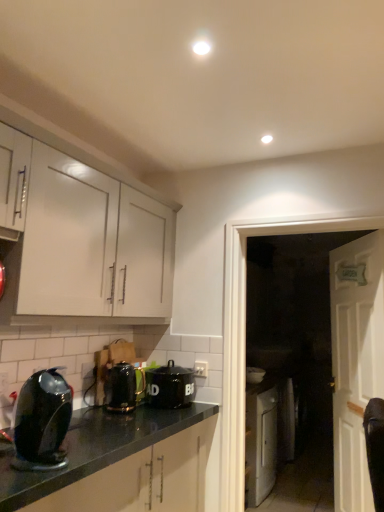
Question: Considering the positions of point (29, 385) and point (236, 243), is point (29, 385) closer or farther from the camera than point (236, 243)?

Choices:
 (A) farther
 (B) closer

Answer: (B)

Question: Is shiny black kettle at lower left, which ranks as the first kitchen appliance in front-to-back order, taller or shorter than white glossy door at right?

Choices:
 (A) short
 (B) tall

Answer: (A)

Question: Which is farther from the white wooden door at right?

Choices:
 (A) metallic black kettle at lower center, positioned as the second kitchen appliance in right-to-left order
 (B) black ceramic canister at center, placed as the 3th kitchen appliance when sorted from left to right
 (C) white glossy door at right
 (D) shiny black kettle at lower left, positioned as the 3th kitchen appliance in right-to-left order
 (E) white glossy cabinet at upper left

Answer: (D)

Question: Based on their relative distances, which object is nearer to the metallic black kettle at lower center, arranged as the 2th kitchen appliance when viewed from the front?

Choices:
 (A) white wooden door at right
 (B) white glossy cabinet at upper left
 (C) shiny black kettle at lower left, acting as the 1th kitchen appliance starting from the left
 (D) white glossy door at right
 (E) black ceramic canister at center, acting as the 1th kitchen appliance starting from the right

Answer: (E)